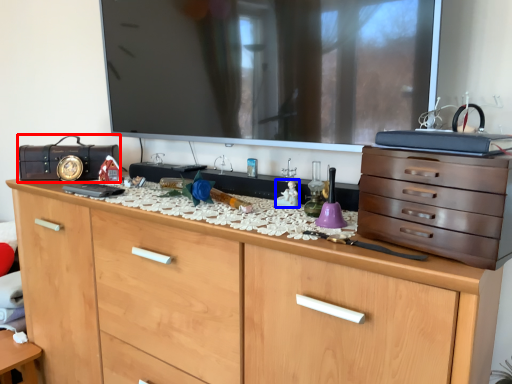
Question: Among these objects, which one is farthest to the camera, radio (highlighted by a red box) or toy (highlighted by a blue box)?

Choices:
 (A) radio
 (B) toy

Answer: (A)